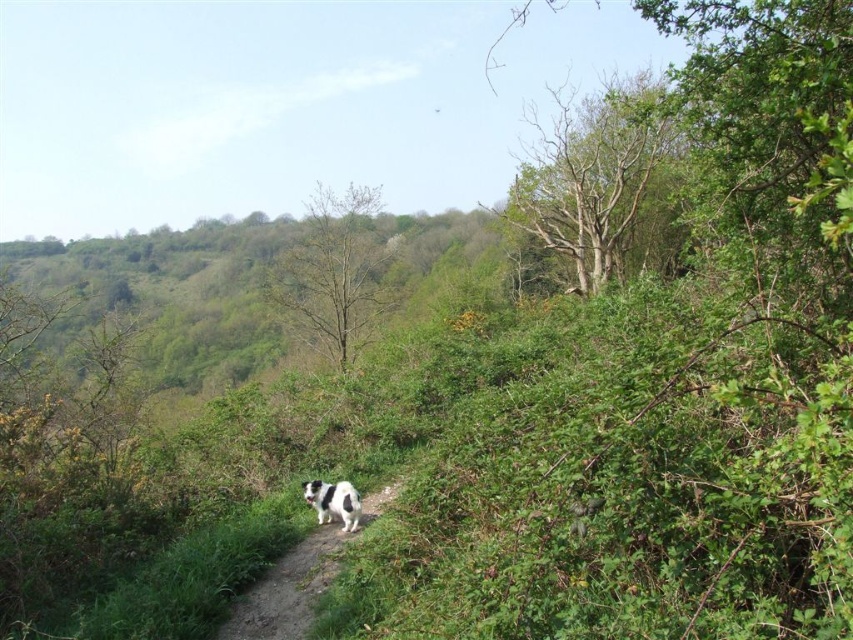
You are standing at the starting point of the dirt path in the foreground. The white fur dog at center is ahead on the path. Based on its position, can you determine if the dog is closer to the foreground or the background?

The white fur dog at center is located at point (x=287, y=589), which places it closer to the foreground since the coordinates indicate it is near the front of the image.

You are standing at the point with coordinates point [316,506] and want to walk to the point with coordinates point [263,634]. Which direction should you move to get closer to your destination?

Since point [263,634] is closer to the camera than point [316,506], you should move towards the direction of the camera to reach your destination.

You are standing at the starting point of the dirt path in the foreground. You see a point marked at coordinates [287,589]. What is the object located at that point?

The point at coordinates [287,589] corresponds to the white fur dog at center.